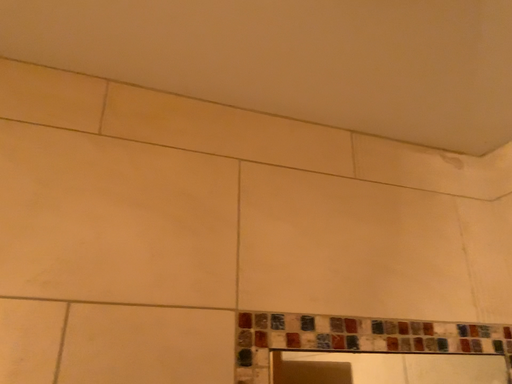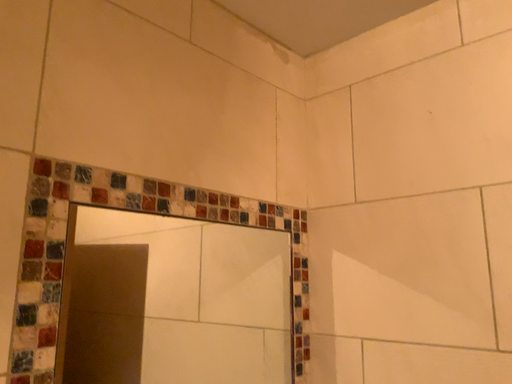
Question: Which way did the camera rotate in the video?

Choices:
 (A) rotated right
 (B) rotated left

Answer: (A)